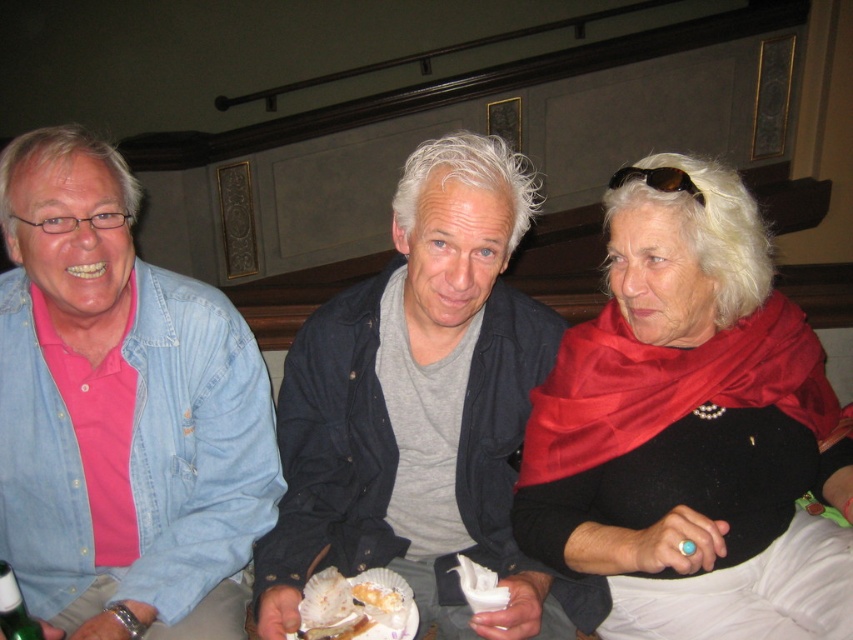
Question: Considering the relative positions of matte blue denim jacket at left and white scallop shell at center in the image provided, where is matte blue denim jacket at left located with respect to white scallop shell at center?

Choices:
 (A) left
 (B) right

Answer: (A)

Question: Which point is closer to the camera taking this photo?

Choices:
 (A) (375, 324)
 (B) (386, 616)
 (C) (65, 292)
 (D) (628, 180)

Answer: (B)

Question: Which of the following is the closest to the observer?

Choices:
 (A) (200, 307)
 (B) (450, 141)
 (C) (685, 352)

Answer: (C)

Question: Can you confirm if satin red scarf at upper right is thinner than white scallop shell at center?

Choices:
 (A) yes
 (B) no

Answer: (B)

Question: Which point is farther to the camera?

Choices:
 (A) golden flaky pastry at center
 (B) white scallop shell at center

Answer: (A)

Question: Does satin red scarf at upper right appear on the right side of brown plastic sunglasses at upper center?

Choices:
 (A) yes
 (B) no

Answer: (A)